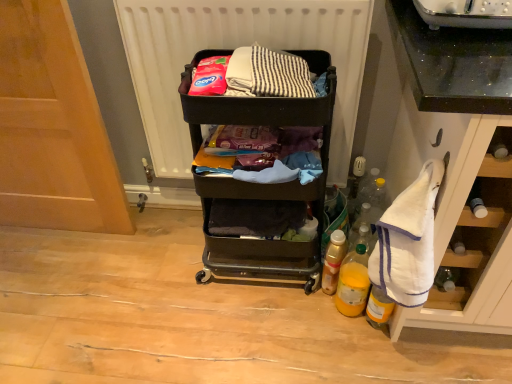
You are a GUI agent. You are given a task and a screenshot of the screen. Output one action in this format:
    pyautogui.click(x=<x>, y=<y>)
    Task: Click on the free space to the left of yellow matte bottle at lower right, arranged as the second bottle when viewed from the left
    This screenshot has height=384, width=512.
    Given the screenshot: What is the action you would take?
    pyautogui.click(x=304, y=317)